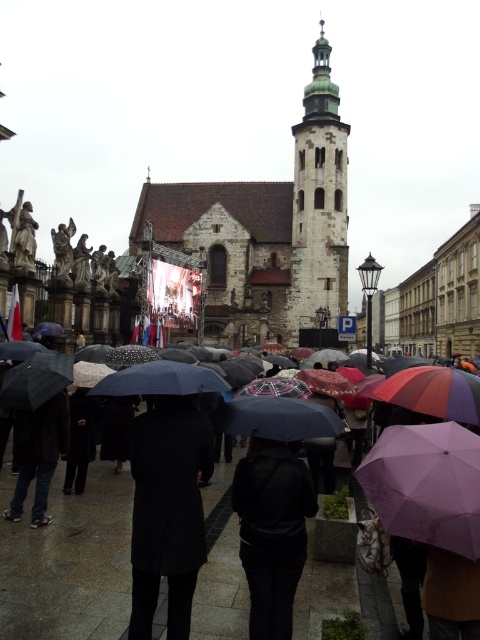
Question: Considering the real-world distances, which object is farthest from the black matte coat at center?

Choices:
 (A) matte black umbrella at center
 (B) white stone tower at center
 (C) stone church at center
 (D) black leather jacket at center

Answer: (C)

Question: Is matte black umbrella at center above stone church at center?

Choices:
 (A) yes
 (B) no

Answer: (B)

Question: Does purple matte umbrella at center appear on the right side of black leather jacket at center?

Choices:
 (A) no
 (B) yes

Answer: (B)

Question: Which point appears farthest from the camera in this image?

Choices:
 (A) (409, 476)
 (B) (179, 468)
 (C) (295, 605)
 (D) (312, 176)

Answer: (D)

Question: Which object appears closest to the camera in this image?

Choices:
 (A) stone church at center
 (B) black matte coat at center

Answer: (B)

Question: Considering the relative positions of matte black umbrella at center and stone church at center in the image provided, where is matte black umbrella at center located with respect to stone church at center?

Choices:
 (A) above
 (B) below

Answer: (B)